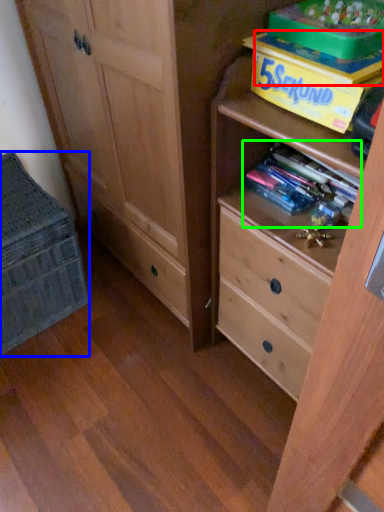
Question: Which object is the farthest from book (highlighted by a red box)? Choose among these: cabinetry (highlighted by a blue box) or book (highlighted by a green box).

Choices:
 (A) cabinetry
 (B) book

Answer: (A)